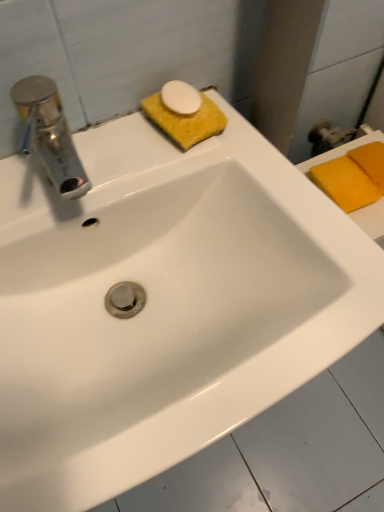
The width and height of the screenshot is (384, 512). I want to click on free space to the left of yellow sponge at upper center, which is the 3th soap in back-to-front order, so click(x=96, y=158).